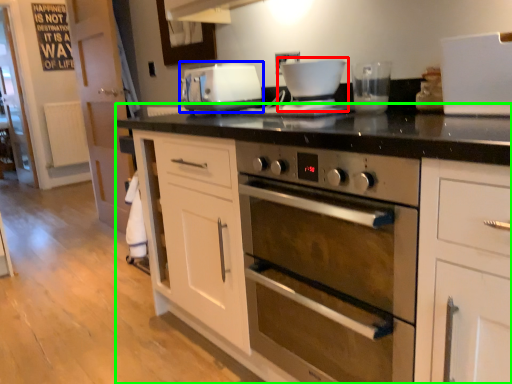
Question: Estimate the real-world distances between objects in this image. Which object is closer to coffee machine (highlighted by a red box), home appliance (highlighted by a blue box) or cabinetry (highlighted by a green box)?

Choices:
 (A) home appliance
 (B) cabinetry

Answer: (A)